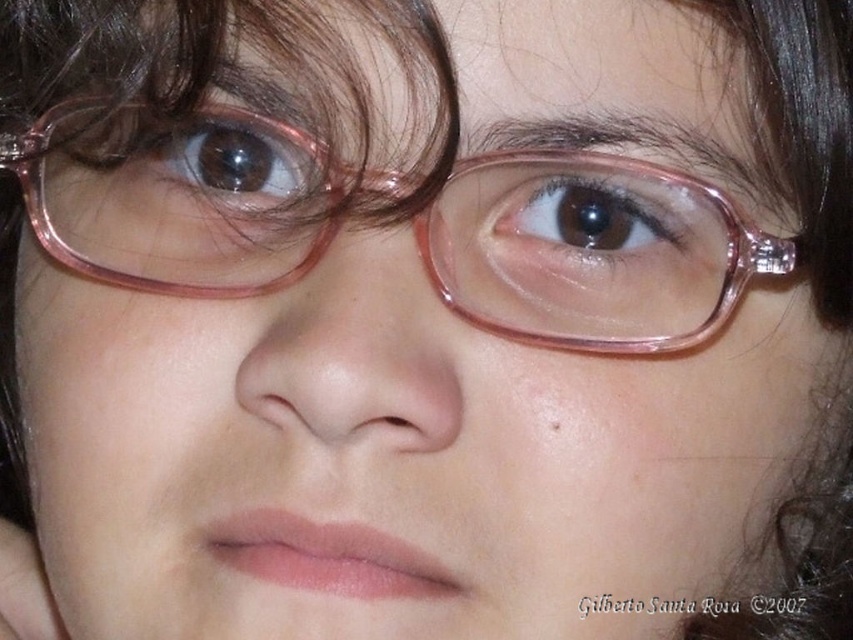
You are an AI analyzing a portrait. The image shows a person with glasses. There is a point at coordinates (601, 214). Based on the scene description, what object does this point most likely correspond to?

The point at coordinates (601, 214) most likely corresponds to the brown glossy eye at center, as the description states that this point corresponds to the brown glossy eye at center.

You are a photographer adjusting the lighting for a portrait. You notice the transparent plastic glasses at center and the brownsmootheye at upper center in the frame. Which object should you adjust the light to highlight first if you want to ensure the reflection on the glasses doesn

The transparent plastic glasses at center is located below the brownsmootheye at upper center. Since the glasses are below the eyes, adjusting the light to highlight the glasses first would require focusing on the lower area of the face to manage reflections properly.

You are a photographer adjusting the focus on a camera. You need to capture a clear image of both the transparent plastic glasses at center and the brownsmootheye at upper center. Given that the depth of field can only sharply focus on one object at a time, which object should you focus on to ensure the other remains relatively in focus? Explain your reasoning based on their distance apart.

Since the transparent plastic glasses at center is only 2.02 inches away from the brownsmootheye at upper center, focusing on the middle point between them would keep both relatively in focus. However, if forced to choose one, focusing on the transparent plastic glasses at center would make the brownsmootheye at upper center slightly out of focus, while focusing on the brownsmootheye at upper center would leave the glasses slightly blurred. To maximize clarity for both, adjust the focus to the midpoint.